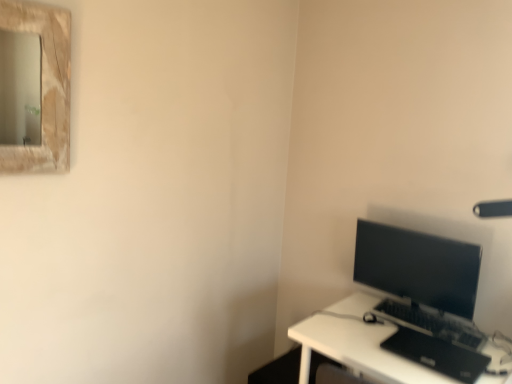
Locate an element on the screen. This screenshot has height=384, width=512. free point above white plastic desk at lower right (from a real-world perspective) is located at coordinates (406, 341).